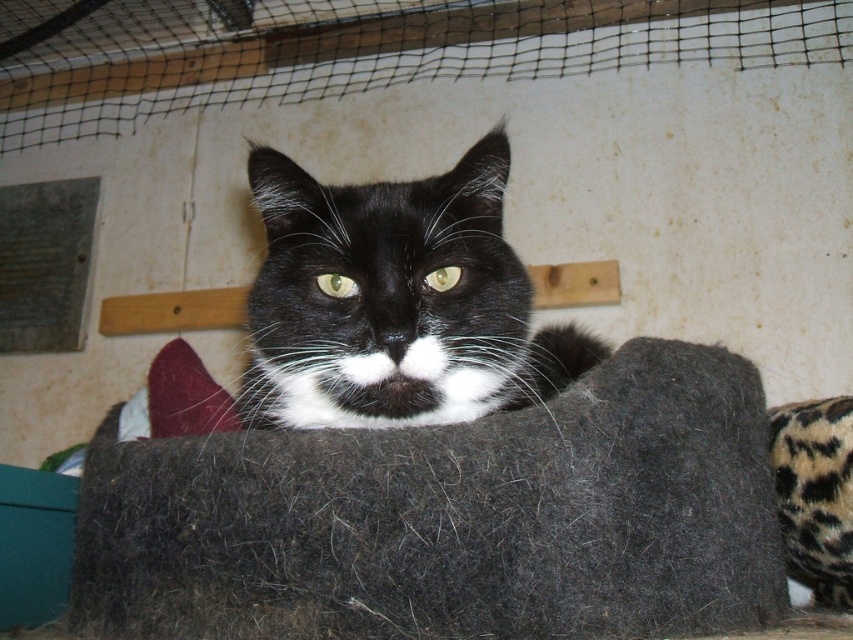
Question: Which of the following is the farthest from the observer?

Choices:
 (A) (444, 228)
 (B) (474, 497)

Answer: (A)

Question: Among these points, which one is farthest from the camera?

Choices:
 (A) (257, 320)
 (B) (734, 506)

Answer: (A)

Question: Does fuzzy charcoal cat bed at center have a greater width compared to black fur cat at center?

Choices:
 (A) yes
 (B) no

Answer: (A)

Question: Which of the following is the closest to the observer?

Choices:
 (A) black fur cat at center
 (B) fuzzy charcoal cat bed at center

Answer: (B)

Question: Is fuzzy charcoal cat bed at center smaller than black fur cat at center?

Choices:
 (A) no
 (B) yes

Answer: (B)

Question: Observing the image, what is the correct spatial positioning of fuzzy charcoal cat bed at center in reference to black fur cat at center?

Choices:
 (A) below
 (B) above

Answer: (A)